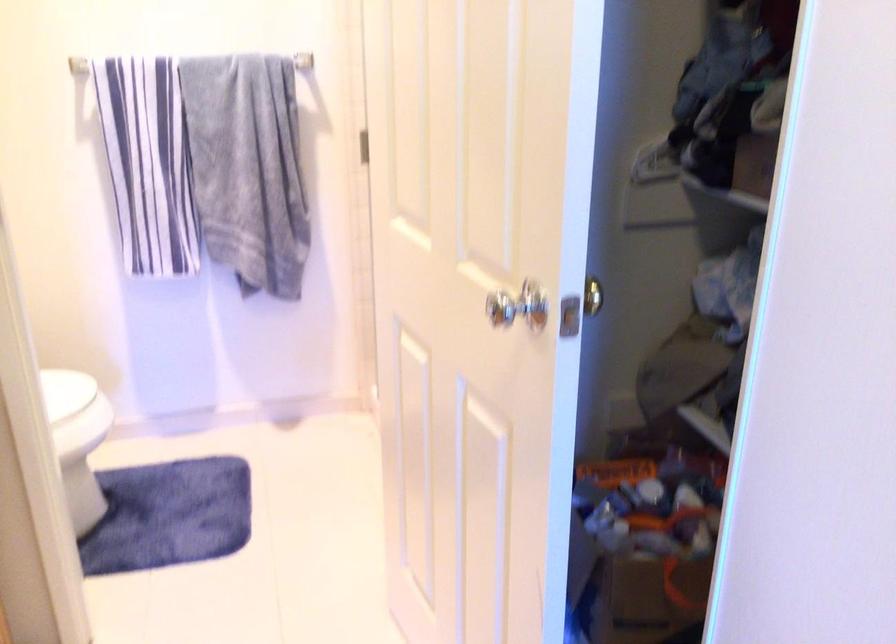
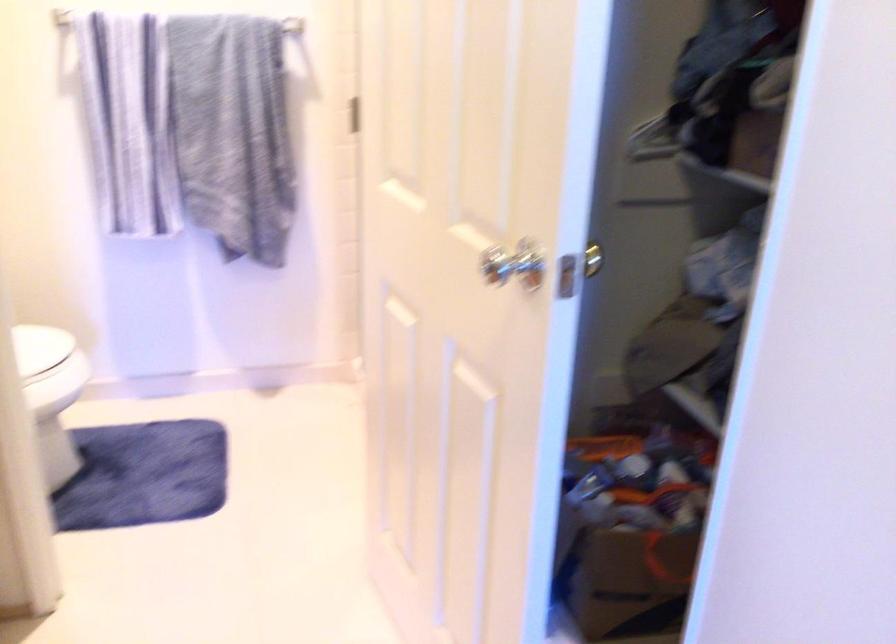
Question: The images are taken continuously from a first-person perspective. In which direction is your viewpoint rotating?

Choices:
 (A) Left
 (B) Right
 (C) Up
 (D) Down

Answer: (B)